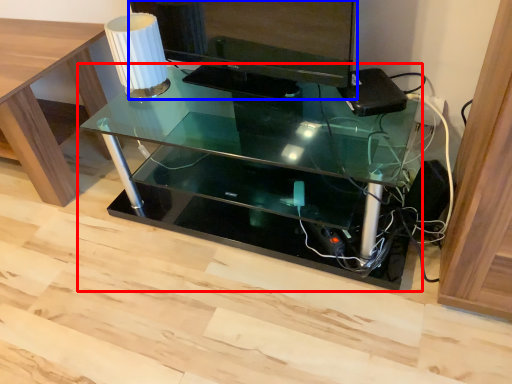
Question: Among these objects, which one is farthest to the camera, table (highlighted by a red box) or computer monitor (highlighted by a blue box)?

Choices:
 (A) table
 (B) computer monitor

Answer: (B)